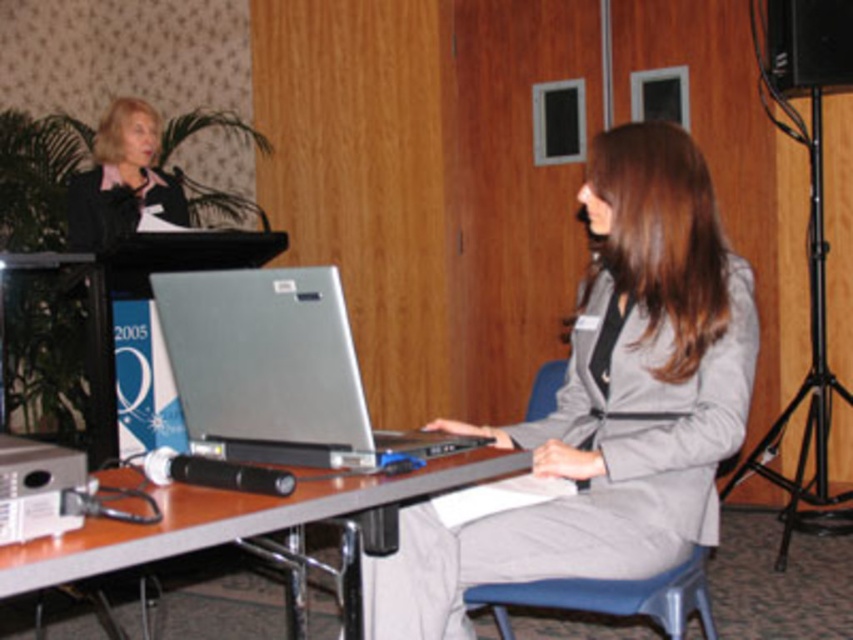
You are organizing a small meeting and need to seat two people in chairs of specific widths. The gray fabric suit at center requires a chair that can accommodate its width, while the matte black suit at upper left needs a narrower seat. Based on the scene description, which person should sit in the wider chair?

The gray fabric suit at center requires a wider chair since its width is larger than the matte black suit at upper left.

You are standing at point (122, 221) and want to walk to point (584, 340). Is the direction you need to walk towards the podium or away from it?

The point (584, 340) is in front of point (122, 221). Since you are at point (122, 221) and want to go to point (584, 340), you need to walk towards the podium.

You are organizing a presentation and need to place a name tag on the table. Considering the silver metallic laptop at center and the metallic gray table at center, where should you place the name tag so it doesn not block the laptop?

The silver metallic laptop at center is located above metallic gray table at center, so placing the name tag below the laptop on the metallic gray table at center would ensure it doesn not block the laptop.